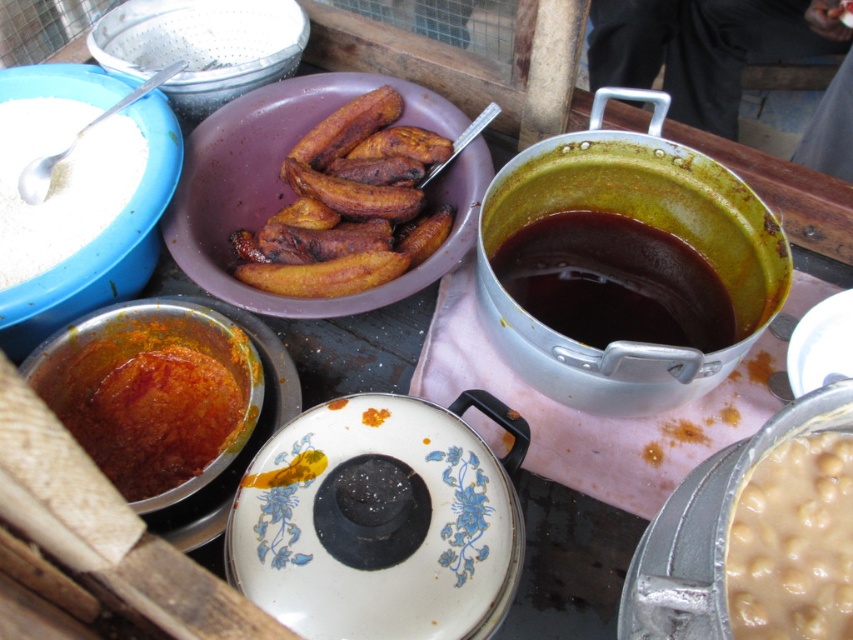
Between point (799, 548) and point (3, 301), which one is positioned behind?

Point (3, 301)

Does creamy beige beans at center come behind white matte bowl at upper left?

No, creamy beige beans at center is closer to the viewer.

Is point (844, 506) behind point (15, 332)?

That is False.

In order to click on creamy beige beans at center in this screenshot , I will do `click(793, 544)`.

Does brown matte plantains at center have a larger size compared to brushed metal strainer at upper left?

Correct, brown matte plantains at center is larger in size than brushed metal strainer at upper left.

Between brown matte plantains at center and brushed metal strainer at upper left, which one is positioned lower?

Positioned lower is brown matte plantains at center.

Between point (316, 129) and point (225, 99), which one is positioned behind?

The point (225, 99) is more distant.

Identify the location of brown matte plantains at center. The image size is (853, 640). (343, 205).

Does brown matte plantains at center appear on the right side of creamy beige beans at center?

In fact, brown matte plantains at center is to the left of creamy beige beans at center.

Based on the photo, does brown matte plantains at center appear on the left side of creamy beige beans at center?

Correct, you'll find brown matte plantains at center to the left of creamy beige beans at center.

Is point (393, 108) farther from camera compared to point (846, 620)?

Yes, it is.

Identify the location of brown matte plantains at center. (343, 205).